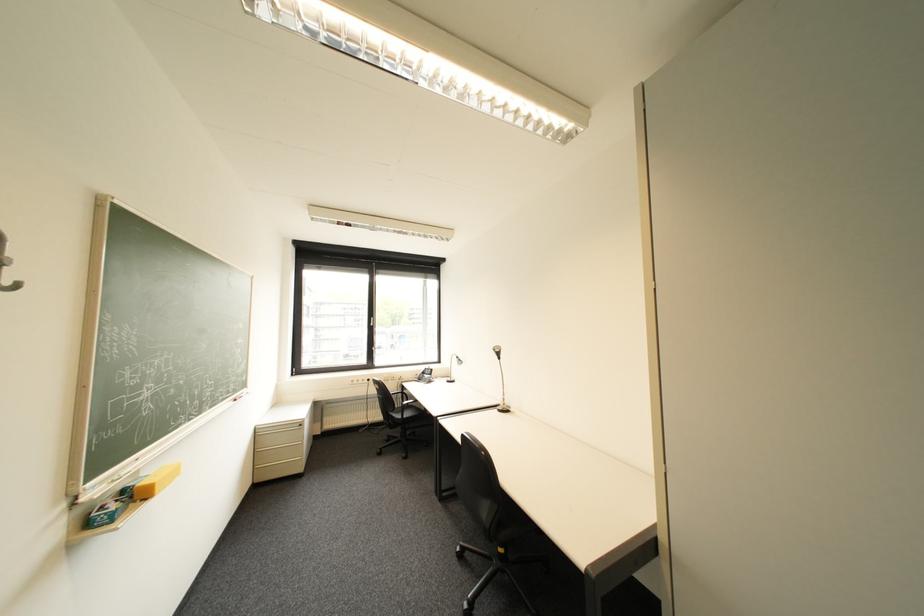
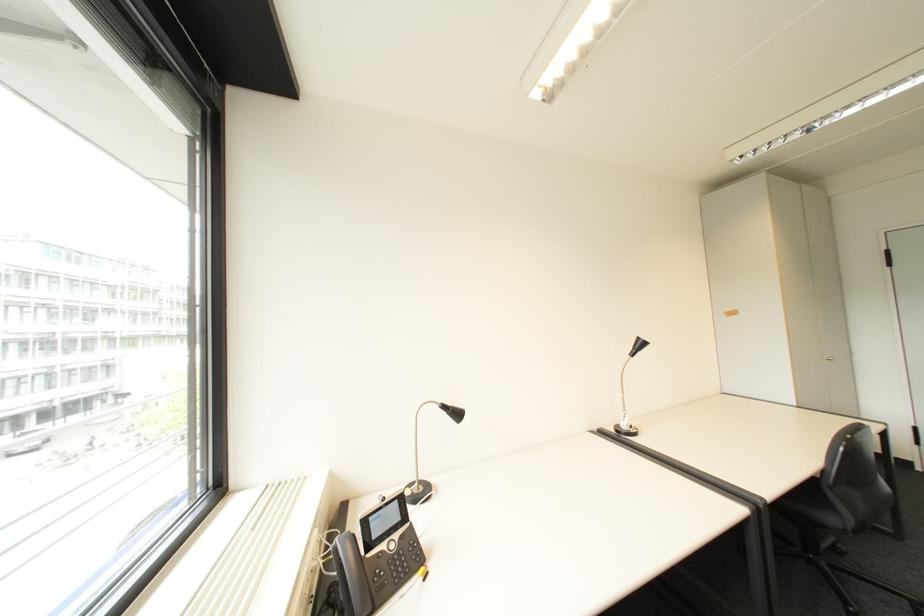
Where in the second image is the point corresponding to point 468,358 from the first image?

(455, 407)